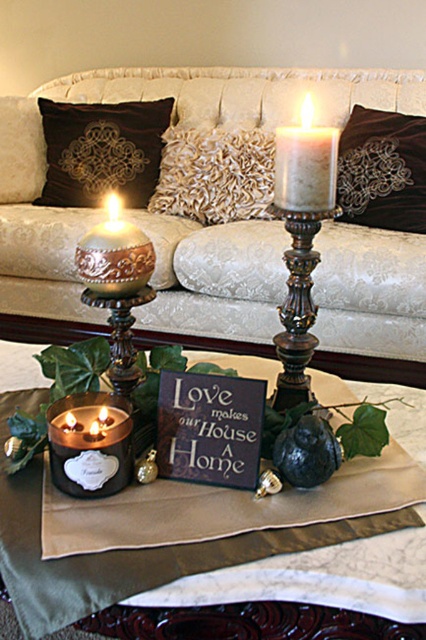
Question: Does matte black candle at center have a larger size compared to velvet pillow at upper left?

Choices:
 (A) no
 (B) yes

Answer: (B)

Question: Is velvet brown pillow at center smaller than matte gray candle at center?

Choices:
 (A) yes
 (B) no

Answer: (B)

Question: Which of the following is the farthest from the observer?

Choices:
 (A) gold textured candle at center
 (B) matte black candle at center
 (C) creamy fabric couch at center

Answer: (C)

Question: Does creamy fabric couch at center lie in front of matte gold candle holder at lower left?

Choices:
 (A) no
 (B) yes

Answer: (A)

Question: Based on their relative distances, which object is farther from the velvet pillow at upper left?

Choices:
 (A) matte gold candle holder at lower left
 (B) matte black candle at center
 (C) matte gray candle at center

Answer: (A)

Question: Which object is the farthest from the velvet brown pillow at center?

Choices:
 (A) velvet pillow at upper left
 (B) gold textured pillow at center
 (C) creamy fabric couch at center

Answer: (A)